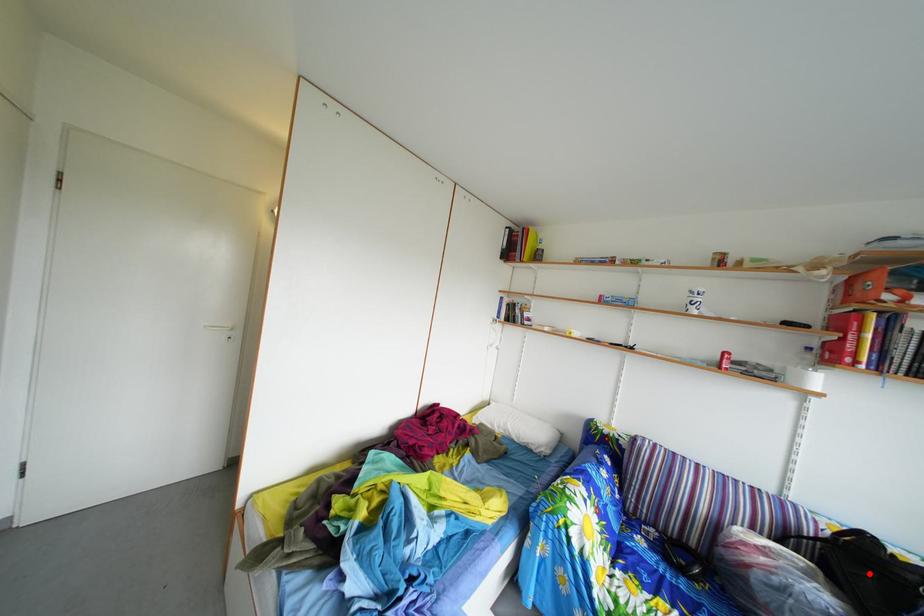
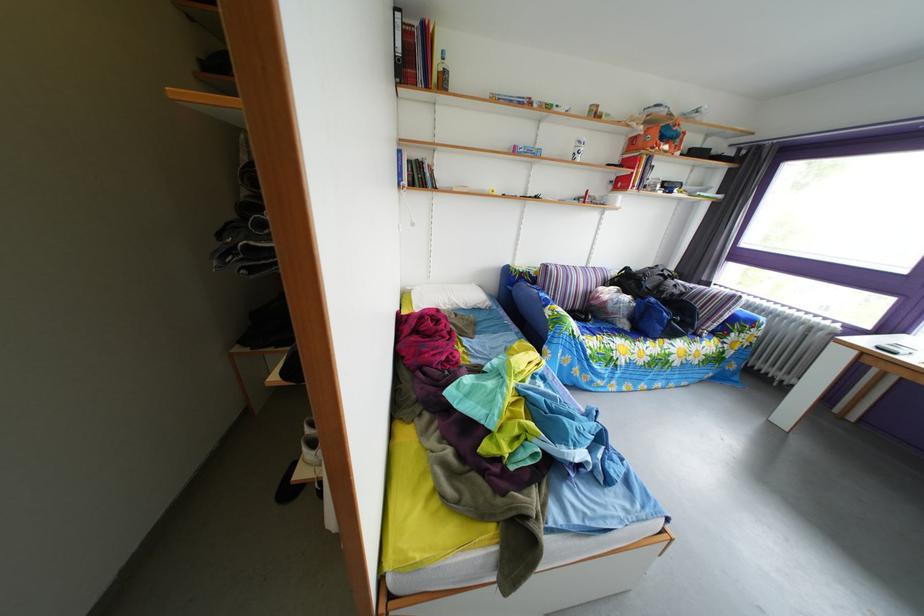
Find the pixel in the second image that matches the highlighted location in the first image.

(638, 289)